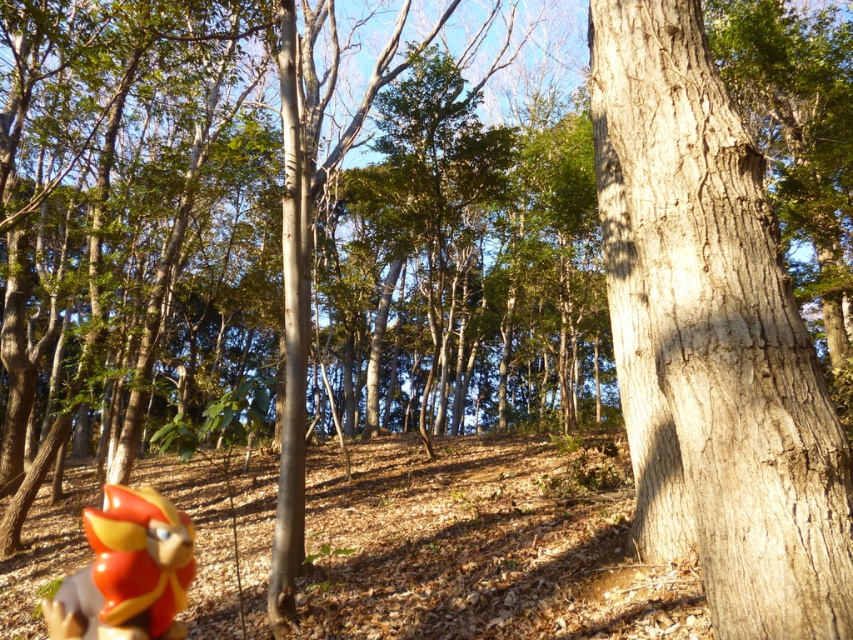
You are standing in the forest and want to touch the smooth gray bark at right. Which direction should you move from your current position, which is at point (712, 339)?

The point (712, 339) is already the location of the smooth gray bark at right, so you are already touching it.

You are a bird flying in the forest and want to land on a smooth surface. You see the smooth gray bark at right and the shiny plastic bird at lower left. Which one is higher up where you can land?

The smooth gray bark at right is above the shiny plastic bird at lower left, so you can land on the smooth gray bark at right since it is higher.